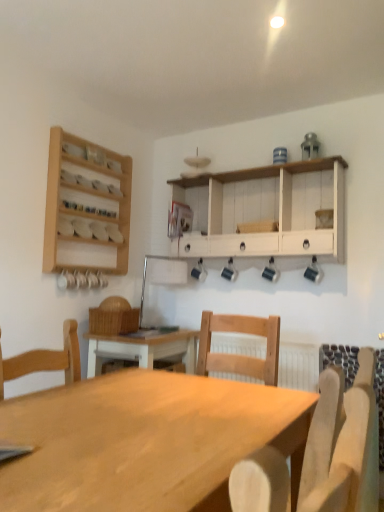
Question: Is light wood chair at center touching white wood cabinet at upper center?

Choices:
 (A) yes
 (B) no

Answer: (B)

Question: Considering the relative sizes of light wood chair at center and white wood cabinet at upper center in the image provided, is light wood chair at center shorter than white wood cabinet at upper center?

Choices:
 (A) no
 (B) yes

Answer: (B)

Question: From a real-world perspective, is light wood chair at center physically above white wood cabinet at upper center?

Choices:
 (A) no
 (B) yes

Answer: (A)

Question: Could you tell me if light wood chair at center is facing white wood cabinet at upper center?

Choices:
 (A) yes
 (B) no

Answer: (B)

Question: Is light wood chair at center further to camera compared to white wood cabinet at upper center?

Choices:
 (A) no
 (B) yes

Answer: (A)

Question: Are light wood chair at center and white wood cabinet at upper center far apart?

Choices:
 (A) no
 (B) yes

Answer: (B)

Question: From the image's perspective, is wooden spice rack at upper left over light wood table at center?

Choices:
 (A) no
 (B) yes

Answer: (B)

Question: Does wooden spice rack at upper left appear on the right side of light wood table at center?

Choices:
 (A) no
 (B) yes

Answer: (A)

Question: Does wooden spice rack at upper left turn towards light wood table at center?

Choices:
 (A) no
 (B) yes

Answer: (A)

Question: Can light wood table at center be found inside wooden spice rack at upper left?

Choices:
 (A) yes
 (B) no

Answer: (B)

Question: Can you confirm if wooden spice rack at upper left is wider than light wood table at center?

Choices:
 (A) yes
 (B) no

Answer: (B)

Question: Considering the relative sizes of wooden spice rack at upper left and light wood table at center in the image provided, is wooden spice rack at upper left bigger than light wood table at center?

Choices:
 (A) no
 (B) yes

Answer: (A)

Question: Is light wood chair at center to the right of light wood table at center from the viewer's perspective?

Choices:
 (A) no
 (B) yes

Answer: (B)